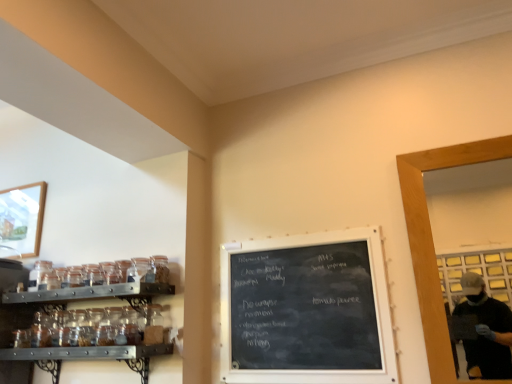
Question: Considering the positions of wooden framed picture at upper left and wooden frame at right in the image, is wooden framed picture at upper left wider or thinner than wooden frame at right?

Choices:
 (A) wide
 (B) thin

Answer: (A)

Question: Does point (20, 213) appear closer or farther from the camera than point (413, 185)?

Choices:
 (A) farther
 (B) closer

Answer: (A)

Question: Which object is positioned closest to the clear glass jar at left, which is the second glass jar in front-to-back order?

Choices:
 (A) black chalkboard at center
 (B) wooden framed picture at upper left
 (C) clear glass jars at left
 (D) transparent glass jar at upper left, acting as the 2th glass jar starting from the left
 (E) wooden frame at right

Answer: (C)

Question: Which of these objects is positioned farthest from the transparent glass jar at upper left, which ranks as the first glass jar in front-to-back order?

Choices:
 (A) black chalkboard at center
 (B) clear glass jars at left
 (C) wooden framed picture at upper left
 (D) clear glass jar at left, the first glass jar when ordered from back to front
 (E) wooden frame at right

Answer: (E)